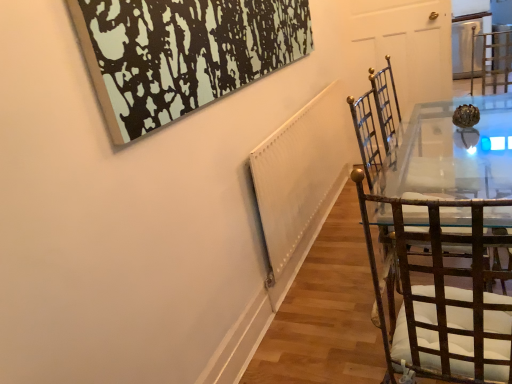
What do you see at coordinates (444, 302) in the screenshot? The image size is (512, 384). I see `metallic gold chair at right` at bounding box center [444, 302].

The width and height of the screenshot is (512, 384). Identify the location of metallic gold chair at right. pyautogui.click(x=444, y=302).

Find the location of a particular element. The height and width of the screenshot is (384, 512). metallic gold chair at right is located at coordinates (444, 302).